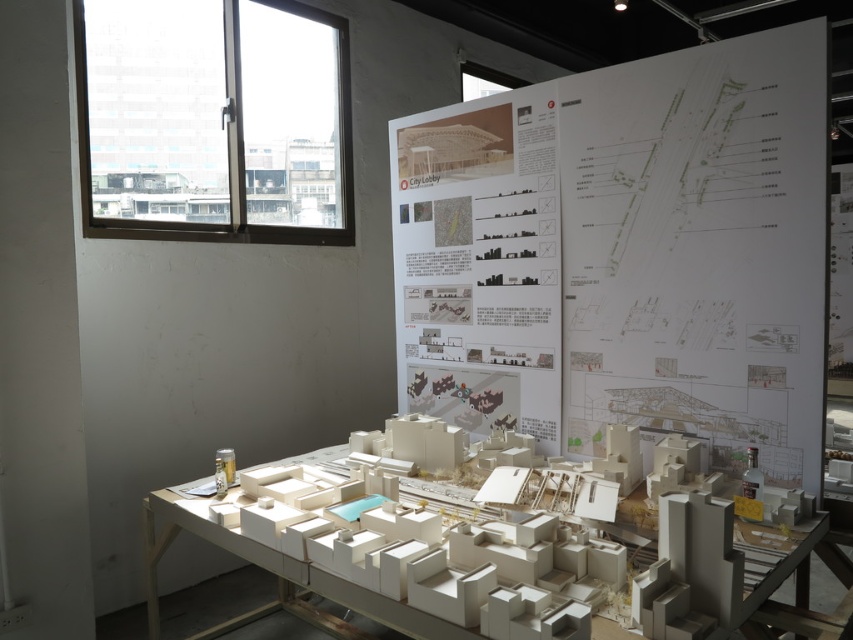
You are an architect reviewing a city model and its accompanying posters. You need to compare the sizes of the white paper poster at upper center and the white cardboard model at center. Which one is bigger?

The white cardboard model at center is bigger than the white paper poster at upper center.

You are standing in front of an architectural display. You see the white paper poster at upper center and the white cardboard model at center. Which object is closer to you?

The white paper poster at upper center is closer to you because it is further to the viewer than the white cardboard model at center.

Consider the image. You are standing in front of a city model and want to read the white paper poster at upper center. Can you reach it without moving closer?

The white paper poster at upper center is 1.82 meters from viewer, so if you are standing in front of the city model, you can reach it without moving closer as it is within arm